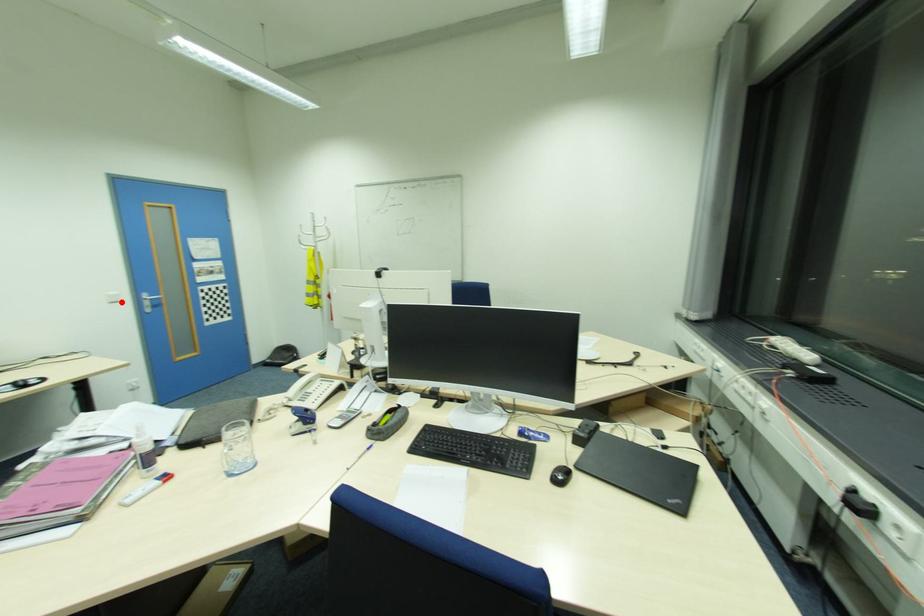
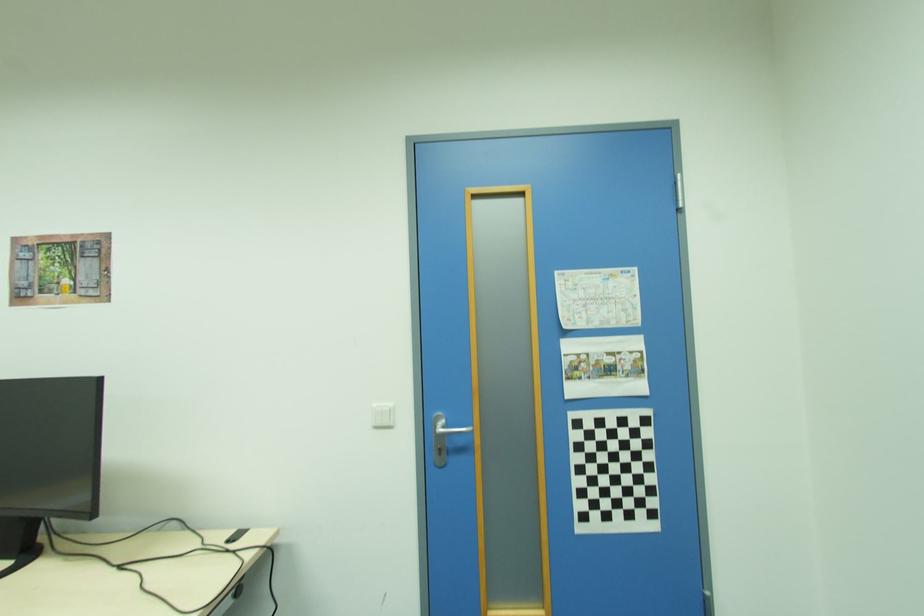
Locate, in the second image, the point that corresponds to the highlighted location in the first image.

(394, 427)